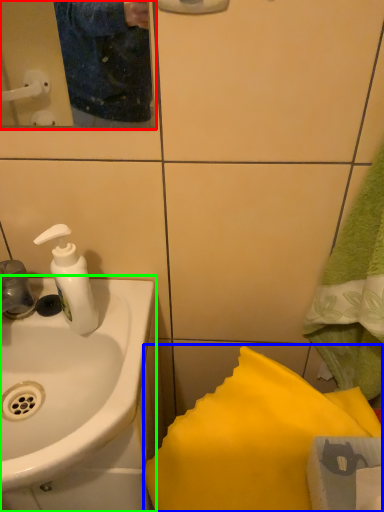
Question: Estimate the real-world distances between objects in this image. Which object is farther from mirror (highlighted by a red box), bath towel (highlighted by a blue box) or sink (highlighted by a green box)?

Choices:
 (A) bath towel
 (B) sink

Answer: (A)